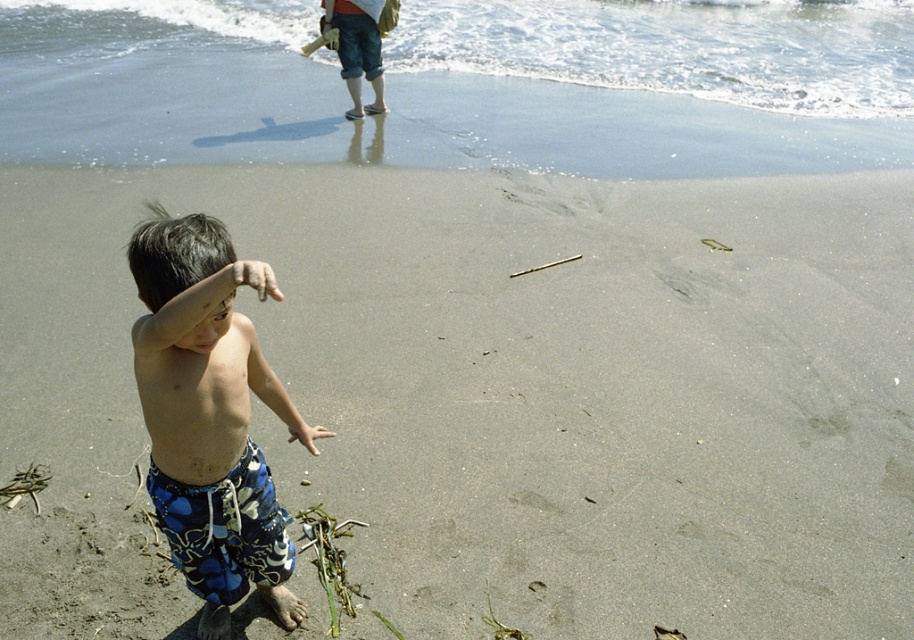
You are a parent watching your child at the beach. You see the clear water at upper center and the blue printed shorts at lower left. Which object is wider in the image?

The clear water at upper center might be wider than blue printed shorts at lower left.